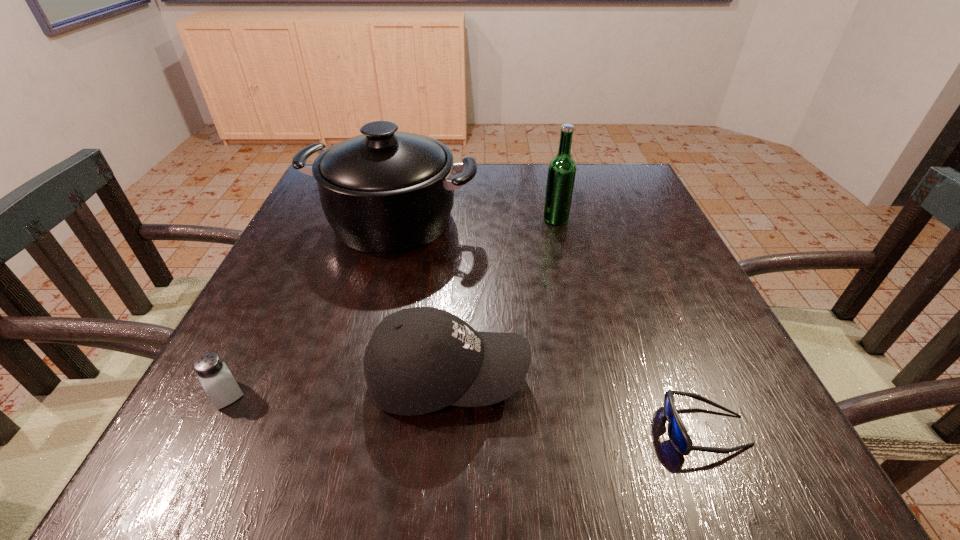
I want to click on vacant point located between the shortest object and the baseball cap, so click(x=576, y=403).

Where is `vacant point located between the sunglasses and the third tallest object`? vacant point located between the sunglasses and the third tallest object is located at coordinates (576, 403).

At what (x,y) coordinates should I click in order to perform the action: click on unoccupied position between the saucepan and the third shortest object. Please return your answer as a coordinate pair (x, y). Looking at the image, I should click on (420, 299).

What are the coordinates of `free point between the fourth tallest object and the sunglasses` in the screenshot? It's located at 466,413.

Locate an element on the screen. The image size is (960, 540). vacant area that lies between the third tallest object and the second object from right to left is located at coordinates (502, 298).

Identify the location of unoccupied position between the second shortest object and the second object from right to left. The height and width of the screenshot is (540, 960). (391, 307).

This screenshot has width=960, height=540. What are the coordinates of `blank region between the saucepan and the beer bottle` in the screenshot? It's located at (474, 220).

This screenshot has width=960, height=540. In order to click on free space between the sunglasses and the fourth object from left to right in this screenshot , I will do `click(630, 325)`.

Locate which object ranks in proximity to the saucepan. Please provide its 2D coordinates. Your answer should be formatted as a tuple, i.e. [(x, y)], where the tuple contains the x and y coordinates of a point satisfying the conditions above.

[(561, 174)]

Find the location of a particular element. This screenshot has height=540, width=960. the closest object to the saucepan is located at coordinates (561, 174).